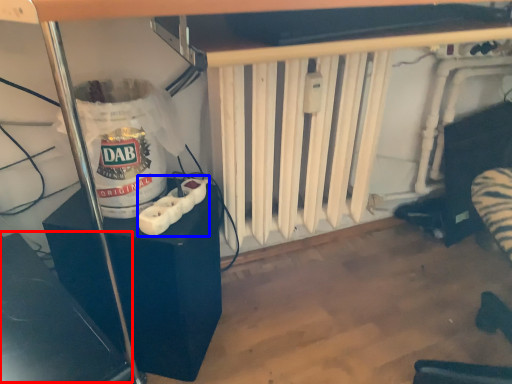
Question: Among these objects, which one is farthest to the camera, wide (highlighted by a red box) or Wii controller (highlighted by a blue box)?

Choices:
 (A) wide
 (B) Wii controller

Answer: (B)